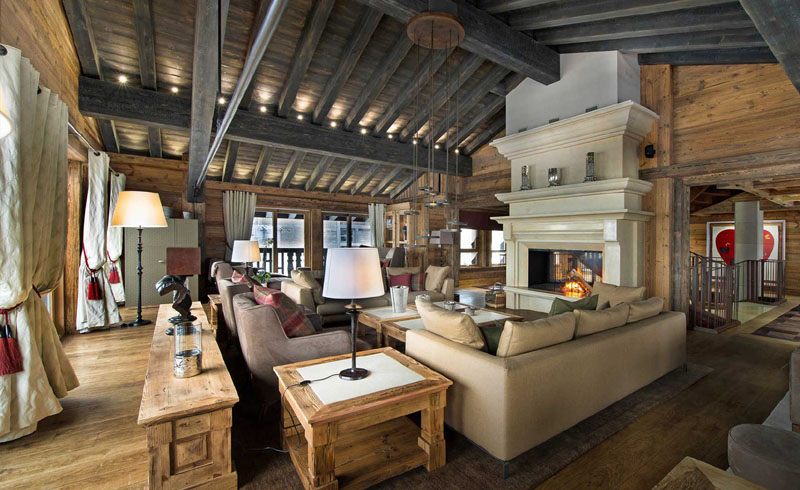
I want to click on couch, so click(x=585, y=354).